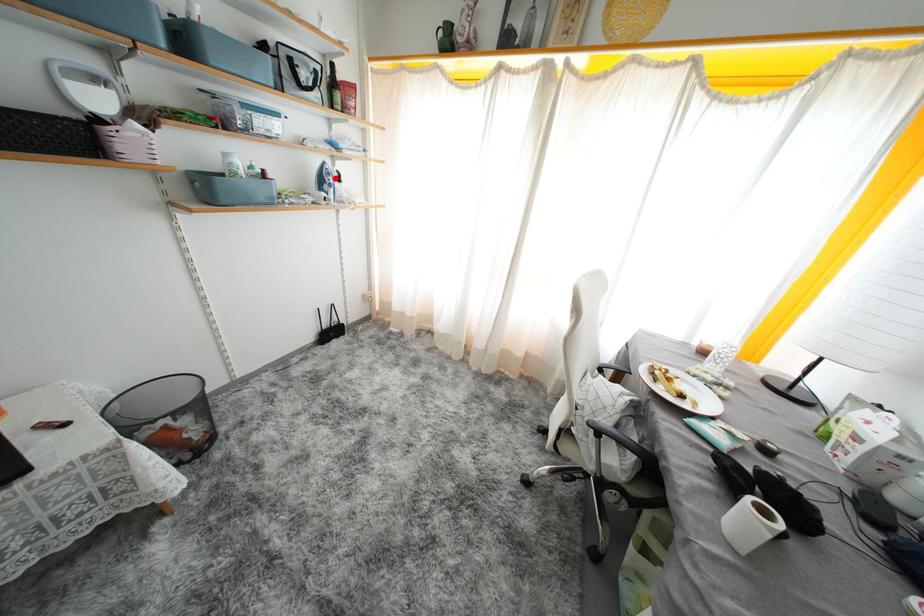
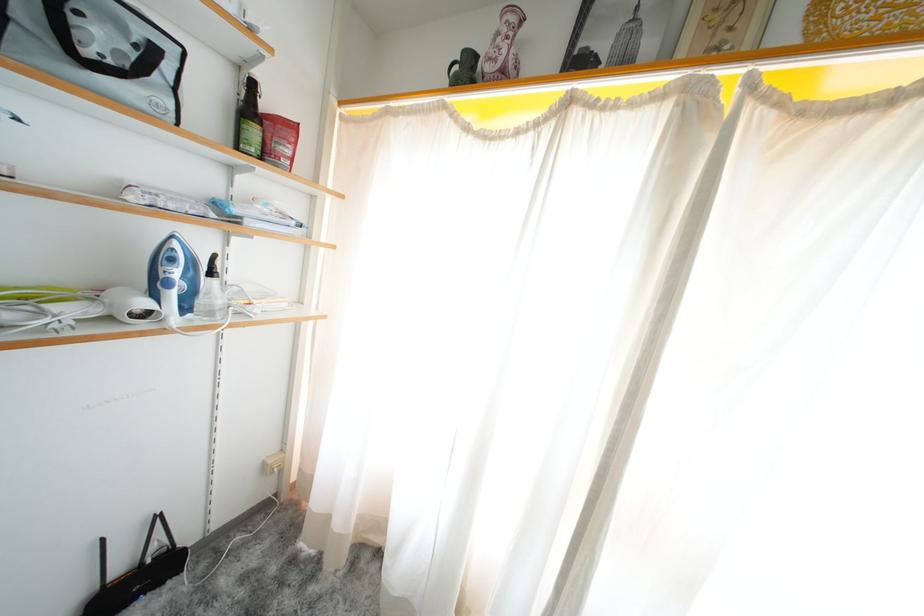
Locate, in the second image, the point that corresponds to the highlighted location in the first image.

(178, 264)